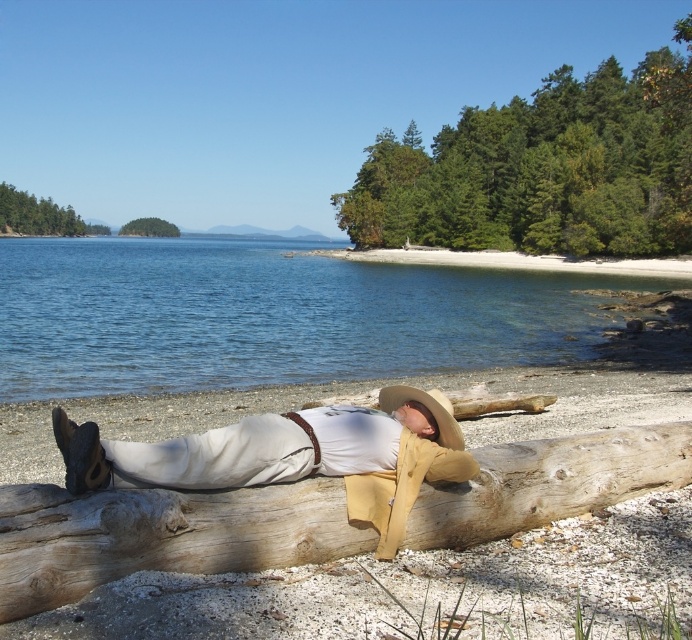
You are a photographer trying to capture the man resting on the beach. You want to ensure that both the light brown wood log at center and the beige straw cowboy hat at center are clearly visible in your shot. Given their sizes, which object will occupy more space in your photo?

The light brown wood log at center will occupy more space in the photo because its width is larger than that of the beige straw cowboy hat at center.

You are standing on the beach and want to take a photo of the clear blue water at center. Where should you point your camera to capture it?

Point your camera towards the center of the scene at coordinates approximately 0.495 on the x axis and 0.389 on the y axis to capture the clear blue water at center.